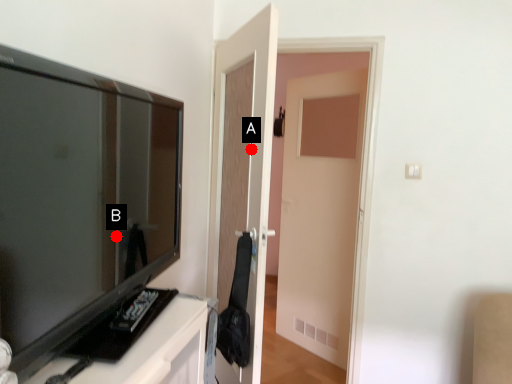
Question: Two points are circled on the image, labeled by A and B beside each circle. Which point is farther from the camera taking this photo?

Choices:
 (A) A is further
 (B) B is further

Answer: (A)